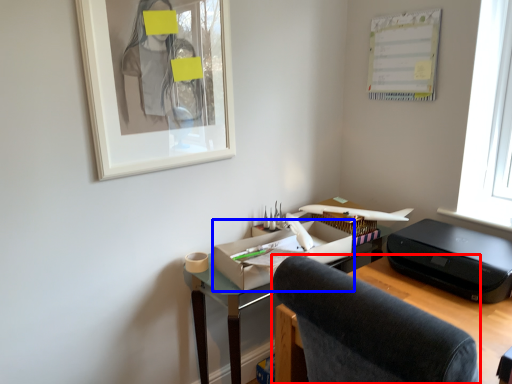
Question: Which point is further to the camera, chair (highlighted by a red box) or office supplies (highlighted by a blue box)?

Choices:
 (A) chair
 (B) office supplies

Answer: (B)